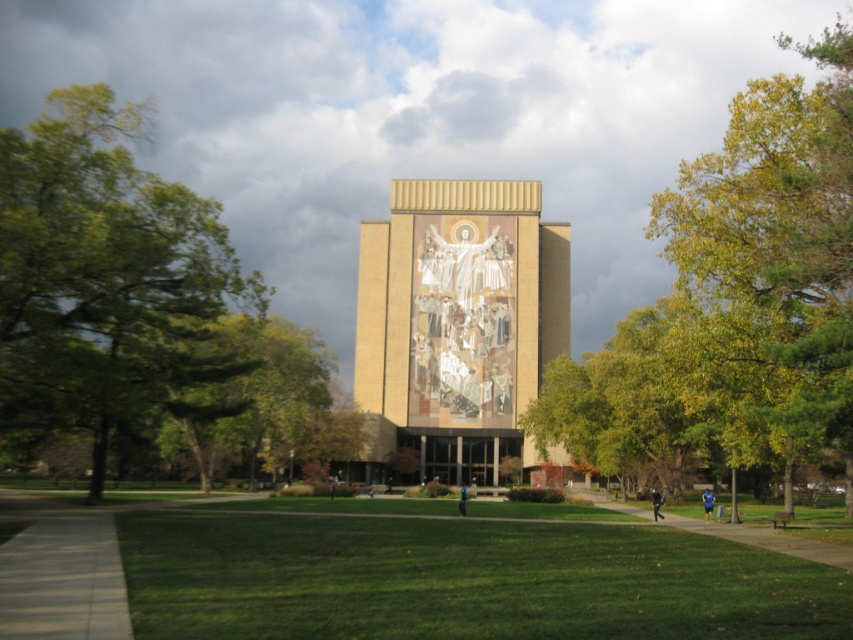
You are standing in the image and want to find a spot to sit where you can see both the green grass at center and the green leafy tree at center. Is there a place where you can sit that allows you to see both?

Yes, you can sit in a position where you can see both the green grass at center and the green leafy tree at center because the green grass at center is positioned under the green leafy tree at center, meaning they are aligned in a way that allows visibility of both from a suitable vantage point.

You are standing at the center of the lawn in front of the building with the religious mural. You see a yellow green leafy tree at right. Where is the point [735,300] located relative to the building?

The point [735,300] is located at the yellow green leafy tree at right.